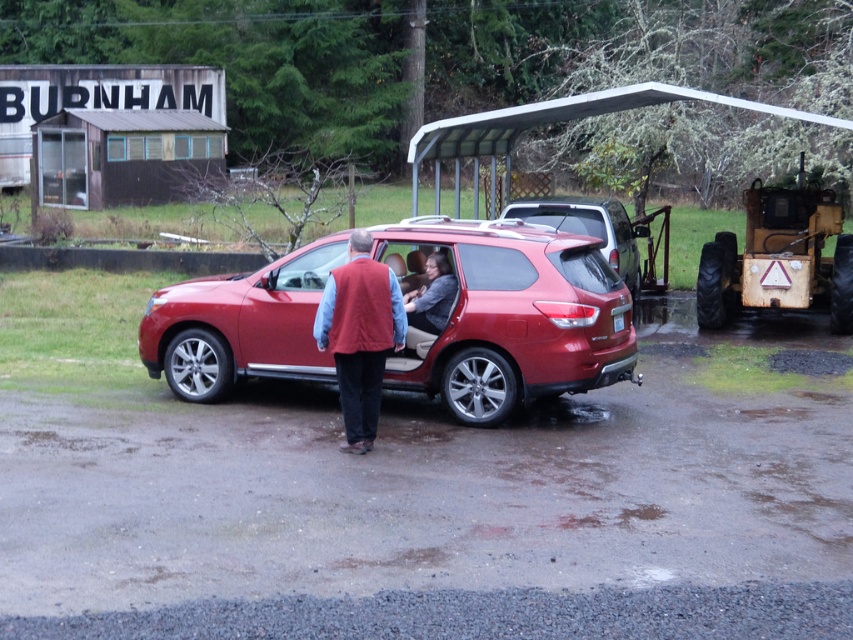
Which is more to the left, shiny metallic suv at center or glossy red minivan at center?

shiny metallic suv at center is more to the left.

Measure the distance from shiny metallic suv at center to glossy red minivan at center.

4.63 meters

At what (x,y) coordinates should I click in order to perform the action: click on shiny metallic suv at center. Please return your answer as a coordinate pair (x, y). The image size is (853, 640). Looking at the image, I should click on (511, 316).

This screenshot has width=853, height=640. What do you see at coordinates (358, 336) in the screenshot? I see `red wool vest at center` at bounding box center [358, 336].

Who is positioned more to the left, red wool vest at center or matte gray sweater at center?

red wool vest at center is more to the left.

Where is `red wool vest at center`? Image resolution: width=853 pixels, height=640 pixels. red wool vest at center is located at coordinates (358, 336).

Is glossy red minivan at center bigger than matte gray sweater at center?

No, glossy red minivan at center is not bigger than matte gray sweater at center.

Which of these two, glossy red minivan at center or matte gray sweater at center, stands taller?

matte gray sweater at center

Describe the element at coordinates (589, 227) in the screenshot. The image size is (853, 640). I see `glossy red minivan at center` at that location.

The width and height of the screenshot is (853, 640). What are the coordinates of `glossy red minivan at center` in the screenshot? It's located at (589, 227).